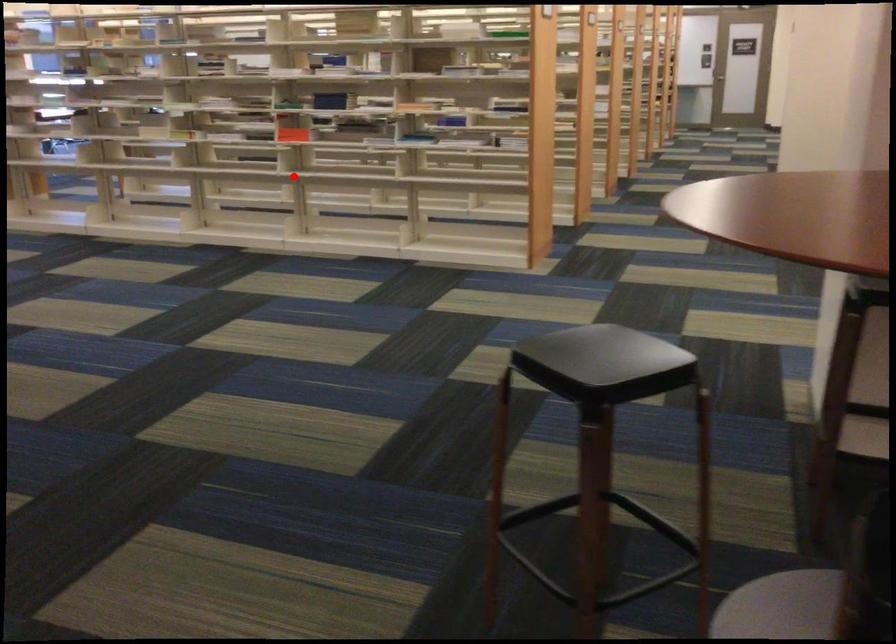
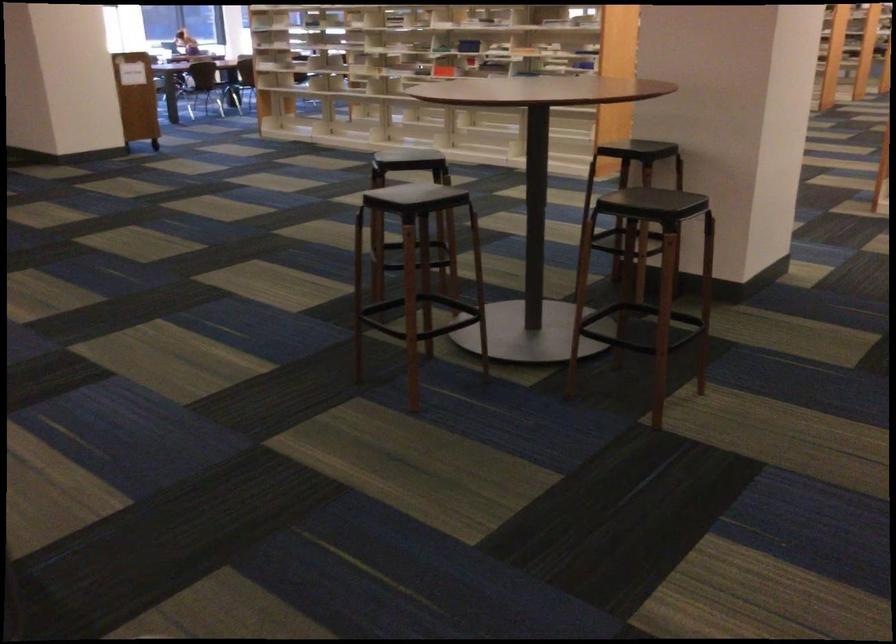
Where in the second image is the point corresponding to the highlighted location from the first image?

(418, 75)